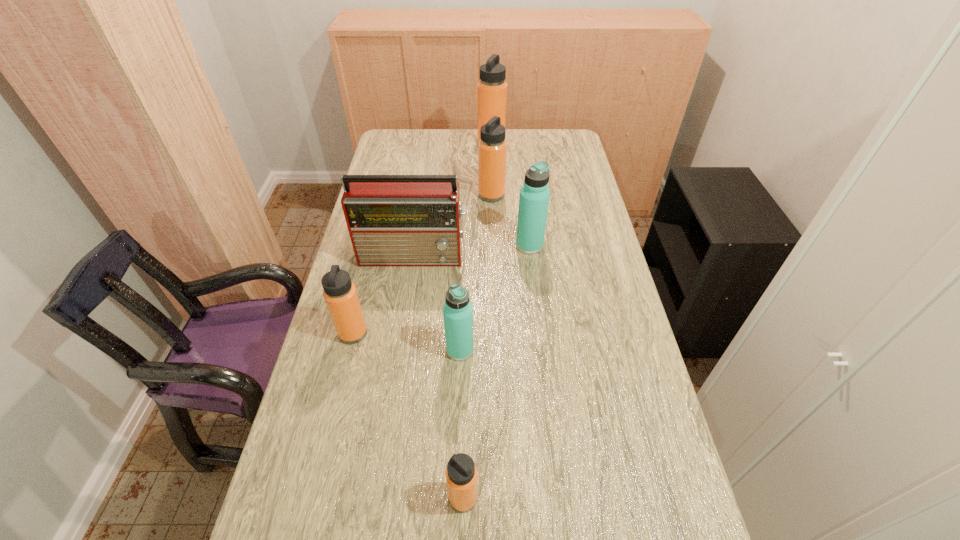
Find the location of a particular element. The height and width of the screenshot is (540, 960). the second nearest orange thermos bottle is located at coordinates [340, 294].

Locate an element on the screen. Image resolution: width=960 pixels, height=540 pixels. the shortest object is located at coordinates (461, 474).

Image resolution: width=960 pixels, height=540 pixels. What are the coordinates of `the nearest orange thermos bottle` in the screenshot? It's located at (461, 474).

Locate an element on the screen. This screenshot has height=540, width=960. vacant region located 0.100m on the right of the biggest orange thermos bottle is located at coordinates (528, 144).

Where is `vacant space located 0.130m on the front-facing side of the radio receiver`? The height and width of the screenshot is (540, 960). vacant space located 0.130m on the front-facing side of the radio receiver is located at coordinates (407, 300).

Image resolution: width=960 pixels, height=540 pixels. I want to click on vacant space located on the front of the fifth nearest thermos bottle, so click(492, 237).

Identify the location of vacant space situated 0.060m on the back of the farther aqua thermos bottle. (527, 225).

Where is `free point located 0.290m on the right of the nearer aqua thermos bottle`? This screenshot has height=540, width=960. free point located 0.290m on the right of the nearer aqua thermos bottle is located at coordinates (583, 350).

At what (x,y) coordinates should I click in order to perform the action: click on free location located 0.340m on the right of the second nearest orange thermos bottle. Please return your answer as a coordinate pair (x, y). Looking at the image, I should click on (492, 333).

The image size is (960, 540). What are the coordinates of `vacant region located 0.110m on the right of the shortest object` in the screenshot? It's located at click(x=531, y=498).